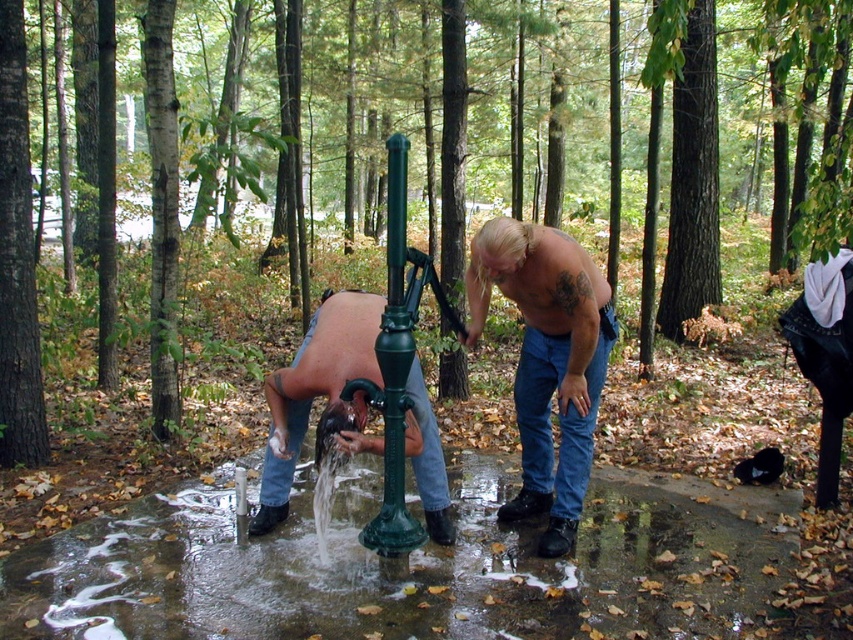
Question: Which point is closer to the camera?

Choices:
 (A) 368,324
 (B) 136,508
 (C) 585,372

Answer: (A)

Question: Does wet concrete puddle at lower center appear on the right side of shiny metallic faucet at center?

Choices:
 (A) no
 (B) yes

Answer: (B)

Question: Does shiny blue jeans at center appear on the right side of shiny metallic faucet at center?

Choices:
 (A) no
 (B) yes

Answer: (B)

Question: Is wet concrete puddle at lower center positioned before shiny metallic faucet at center?

Choices:
 (A) no
 (B) yes

Answer: (B)

Question: Estimate the real-world distances between objects in this image. Which object is closer to the shiny blue jeans at center?

Choices:
 (A) shiny metallic faucet at center
 (B) wet concrete puddle at lower center

Answer: (A)

Question: Estimate the real-world distances between objects in this image. Which object is closer to the wet concrete puddle at lower center?

Choices:
 (A) shiny metallic faucet at center
 (B) shiny blue jeans at center

Answer: (A)